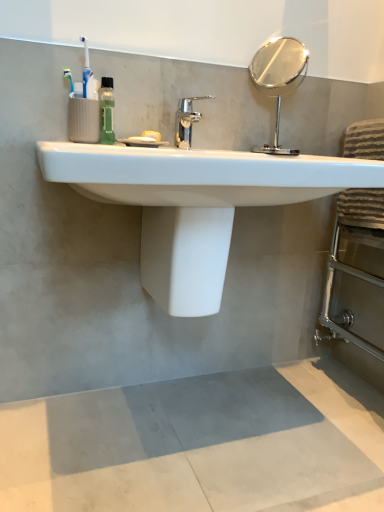
Question: Is green translucent bottle at upper left far from white glossy sink at center?

Choices:
 (A) no
 (B) yes

Answer: (A)

Question: Considering the relative sizes of green translucent bottle at upper left and white glossy sink at center in the image provided, is green translucent bottle at upper left shorter than white glossy sink at center?

Choices:
 (A) no
 (B) yes

Answer: (A)

Question: Does green translucent bottle at upper left have a smaller size compared to white glossy sink at center?

Choices:
 (A) no
 (B) yes

Answer: (B)

Question: Could you tell me if green translucent bottle at upper left is facing white glossy sink at center?

Choices:
 (A) yes
 (B) no

Answer: (B)

Question: Considering the relative positions of green translucent bottle at upper left and white glossy sink at center in the image provided, is green translucent bottle at upper left behind white glossy sink at center?

Choices:
 (A) no
 (B) yes

Answer: (B)

Question: Considering the relative sizes of green translucent bottle at upper left and white glossy sink at center in the image provided, is green translucent bottle at upper left thinner than white glossy sink at center?

Choices:
 (A) yes
 (B) no

Answer: (A)

Question: From the image's perspective, is white glossy sink at center located beneath polished silver mirror at upper right?

Choices:
 (A) yes
 (B) no

Answer: (A)

Question: Can polished silver mirror at upper right be found inside white glossy sink at center?

Choices:
 (A) no
 (B) yes

Answer: (A)

Question: Is white glossy sink at center outside polished silver mirror at upper right?

Choices:
 (A) yes
 (B) no

Answer: (A)

Question: Is white glossy sink at center next to polished silver mirror at upper right and touching it?

Choices:
 (A) no
 (B) yes

Answer: (A)

Question: Can you confirm if white glossy sink at center is thinner than polished silver mirror at upper right?

Choices:
 (A) no
 (B) yes

Answer: (A)

Question: Can you confirm if white glossy sink at center is taller than polished silver mirror at upper right?

Choices:
 (A) no
 (B) yes

Answer: (A)

Question: From the image's perspective, is white glossy toilet bowl at center located above green translucent bottle at upper left?

Choices:
 (A) no
 (B) yes

Answer: (A)